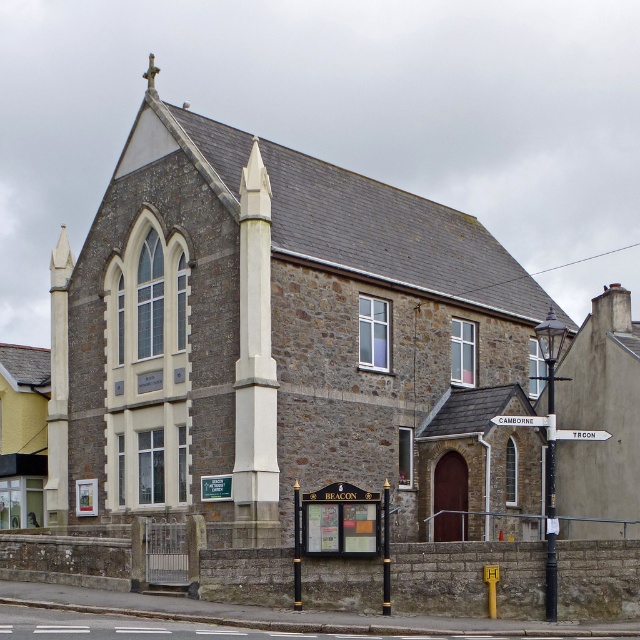
Question: Which of these objects is positioned closest to the white plastic street sign at upper center?

Choices:
 (A) white stone obelisk at center
 (B) white wooden signpost at upper center

Answer: (B)

Question: Which of the following is the closest to the observer?

Choices:
 (A) white stone obelisk at center
 (B) white wooden signpost at upper center
 (C) white plastic street sign at upper center

Answer: (C)

Question: From the image, what is the correct spatial relationship of white stone obelisk at center in relation to white plastic street sign at upper center?

Choices:
 (A) above
 (B) below

Answer: (A)

Question: Which point appears closest to the camera in this image?

Choices:
 (A) (580, 436)
 (B) (534, 420)

Answer: (A)

Question: Can you confirm if white stone obelisk at center is positioned above white wooden signpost at upper center?

Choices:
 (A) yes
 (B) no

Answer: (A)

Question: Is white stone obelisk at center above white plastic street sign at upper center?

Choices:
 (A) no
 (B) yes

Answer: (B)